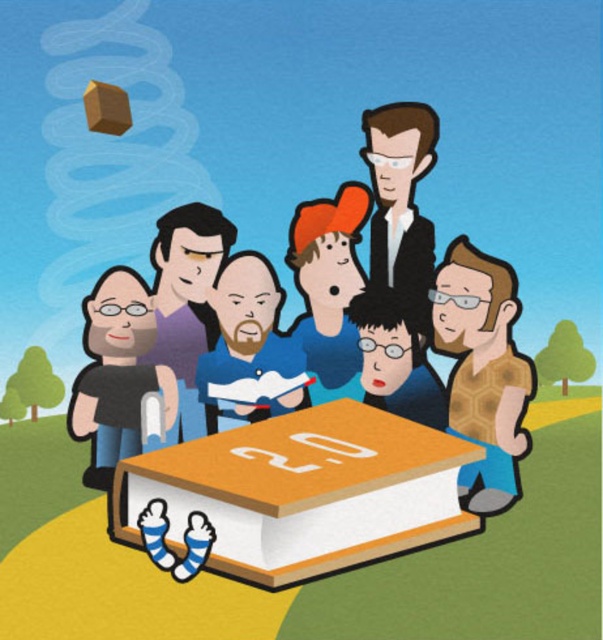
Question: Among these points, which one is farthest from the camera?

Choices:
 (A) (308, 276)
 (B) (130, 356)
 (C) (227, 298)

Answer: (C)

Question: Does brown honeycomb-patterned shirt at lower right appear over dark gray shirt at lower left?

Choices:
 (A) no
 (B) yes

Answer: (B)

Question: Which point is farther from the camera taking this photo?

Choices:
 (A) (238, 330)
 (B) (408, 323)

Answer: (A)

Question: Is dark gray shirt at lower left above orange fabric cap at center?

Choices:
 (A) yes
 (B) no

Answer: (B)

Question: Is the position of orange matte book at center more distant than that of brown honeycomb-patterned shirt at lower right?

Choices:
 (A) yes
 (B) no

Answer: (B)

Question: Which object is the closest to the brown honeycomb-patterned shirt at lower right?

Choices:
 (A) smooth brown hair at center
 (B) blue cotton shirt at center
 (C) dark gray shirt at lower left
 (D) matte purple shirt at center

Answer: (A)